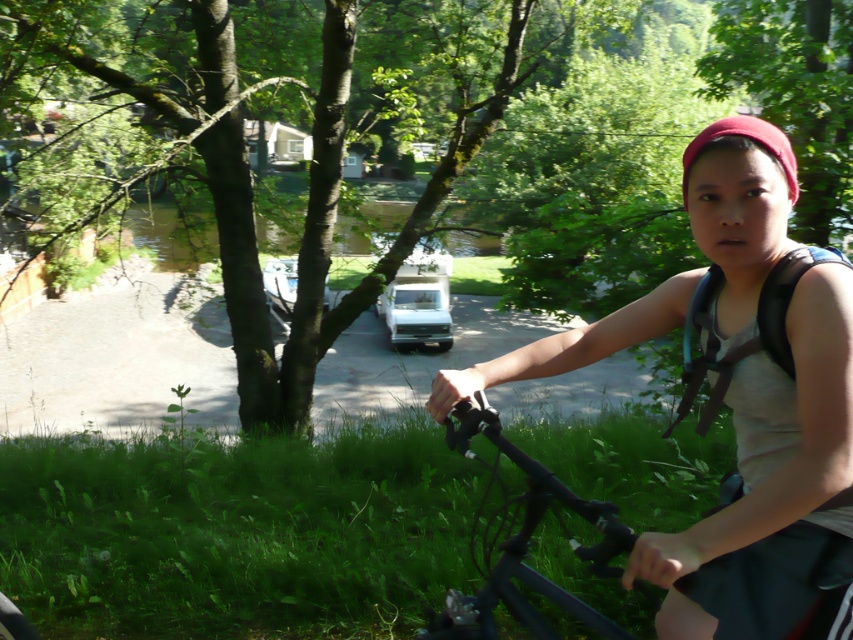
Is black matte bicycle at center above black fabric strap at right?

No.

The image size is (853, 640). In order to click on black matte bicycle at center in this screenshot , I will do `click(527, 541)`.

Between point (505, 580) and point (709, 275), which one is positioned behind?

Point (709, 275)

The height and width of the screenshot is (640, 853). I want to click on black matte bicycle at center, so click(x=527, y=541).

Can you confirm if matte gray tank top at center is shorter than black fabric strap at right?

Incorrect, matte gray tank top at center's height does not fall short of black fabric strap at right's.

Between matte gray tank top at center and black fabric strap at right, which one has more height?

matte gray tank top at center is taller.

Is point (817, 576) farther from camera compared to point (688, 371)?

No.

I want to click on matte gray tank top at center, so click(x=740, y=400).

In the scene shown: Is matte gray tank top at center positioned behind black matte bicycle at center?

No.

Describe the element at coordinates (740, 400) in the screenshot. Image resolution: width=853 pixels, height=640 pixels. I see `matte gray tank top at center` at that location.

Who is more distant from viewer, (843, 289) or (822, 550)?

The point (822, 550) is behind.

At what (x,y) coordinates should I click in order to perform the action: click on matte gray tank top at center. Please return your answer as a coordinate pair (x, y). The image size is (853, 640). Looking at the image, I should click on (740, 400).